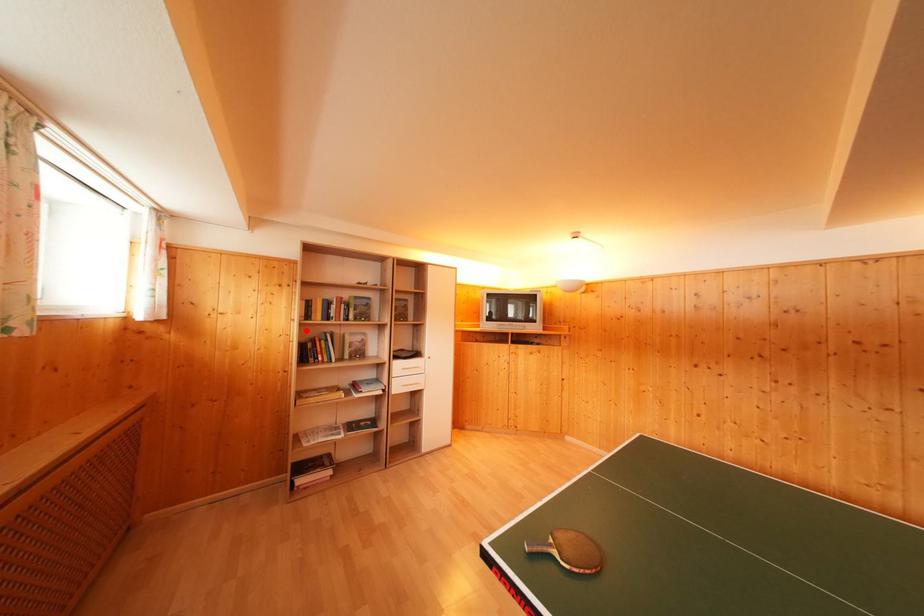
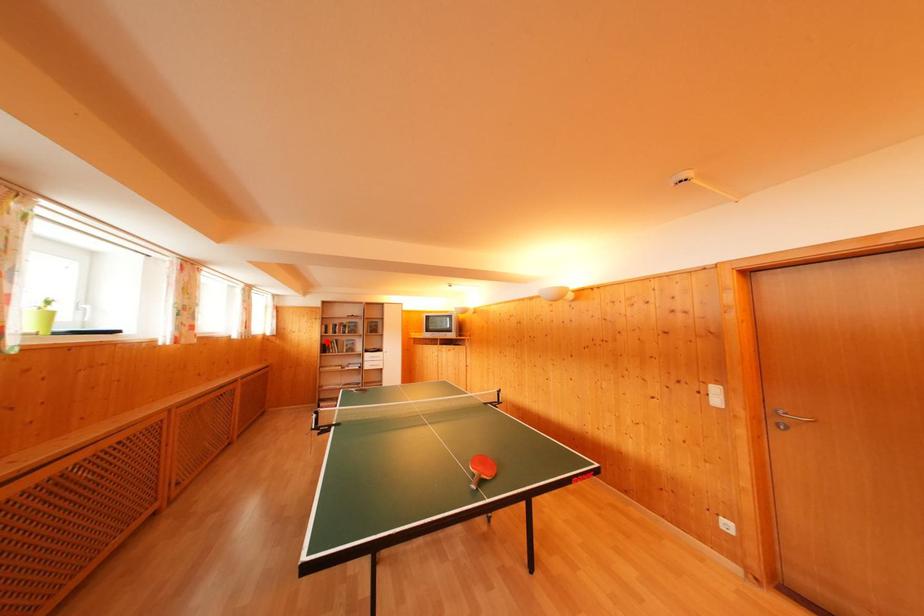
I am providing you with two images of the same scene from different viewpoints. A red point is marked on the first image and another point is marked on the second image. Do the highlighted points in image1 and image2 indicate the same real-world spot?

Yes